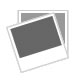
At what (x,y) coordinates should I click in order to perform the action: click on corner. Please return your answer as a coordinate pair (x, y). Image resolution: width=80 pixels, height=80 pixels. Looking at the image, I should click on click(68, 57).